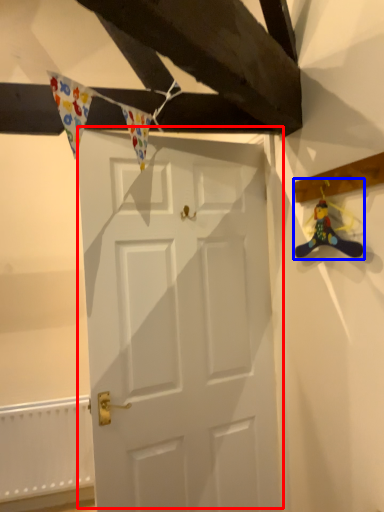
Question: Which object is further to the camera taking this photo, door (highlighted by a red box) or miniature (highlighted by a blue box)?

Choices:
 (A) door
 (B) miniature

Answer: (A)